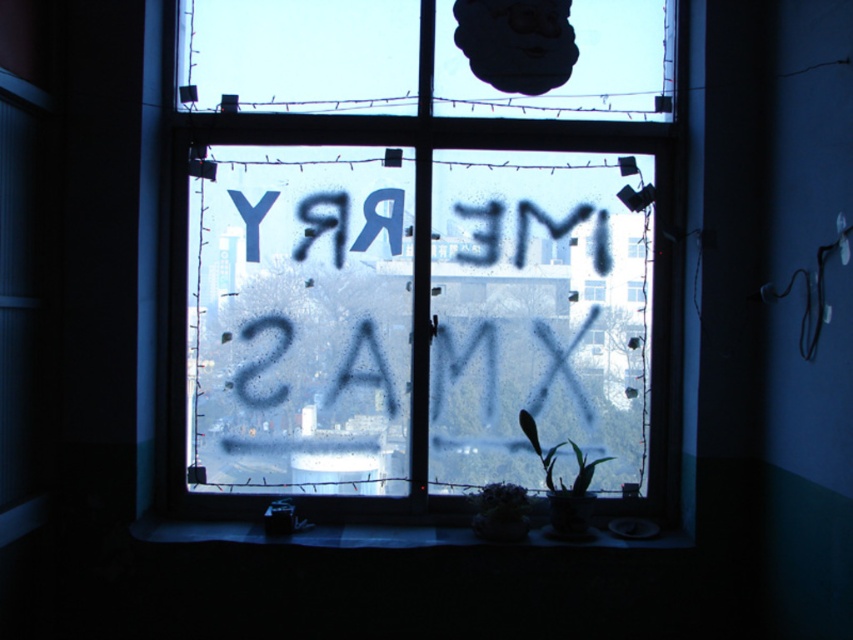
Is frosted glass window at center positioned before smooth concrete surface at lower center?

No, it is behind smooth concrete surface at lower center.

Who is more forward, [231,394] or [332,541]?

Point [332,541] is more forward.

Where is `frosted glass window at center`? The height and width of the screenshot is (640, 853). frosted glass window at center is located at coordinates (415, 262).

Does smooth concrete surface at lower center appear under green leafy plant at center?

Yes.

Does smooth concrete surface at lower center have a smaller size compared to green leafy plant at center?

No.

Describe the element at coordinates (305, 534) in the screenshot. I see `smooth concrete surface at lower center` at that location.

You are a GUI agent. You are given a task and a screenshot of the screen. Output one action in this format:
    pyautogui.click(x=<x>, y=<y>)
    Task: Click on the smooth concrete surface at lower center
    
    Given the screenshot: What is the action you would take?
    pyautogui.click(x=305, y=534)

Is frosted glass window at center shorter than green leafy plant at center?

No, frosted glass window at center is not shorter than green leafy plant at center.

How far apart are frosted glass window at center and green leafy plant at center?

frosted glass window at center is 21.99 inches away from green leafy plant at center.

Which is in front, point (552, 209) or point (589, 500)?

Positioned in front is point (589, 500).

You are a GUI agent. You are given a task and a screenshot of the screen. Output one action in this format:
    pyautogui.click(x=<x>, y=<y>)
    Task: Click on the frosted glass window at center
    This screenshot has height=640, width=853.
    Given the screenshot: What is the action you would take?
    pyautogui.click(x=415, y=262)